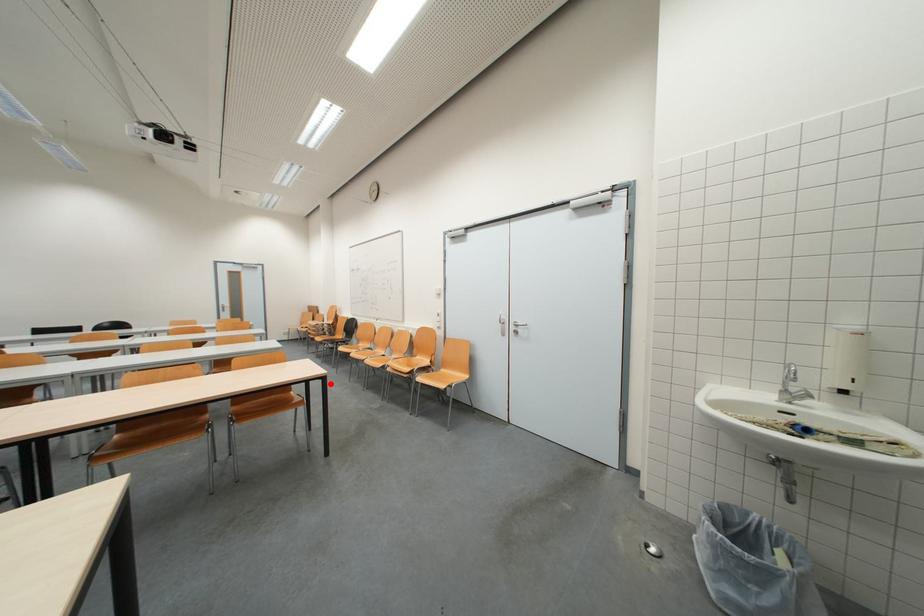
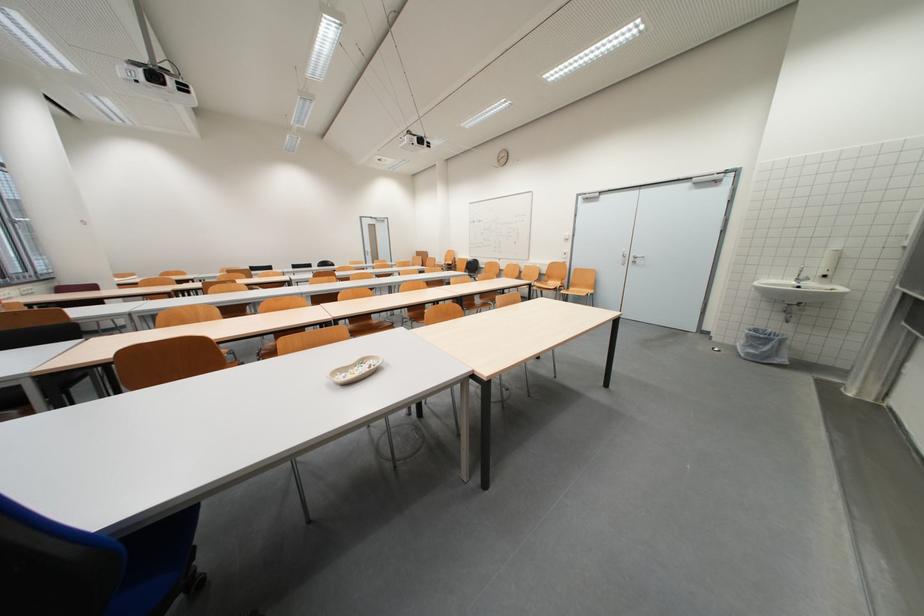
In the second image, find the point that corresponds to the highlighted location in the first image.

(537, 291)